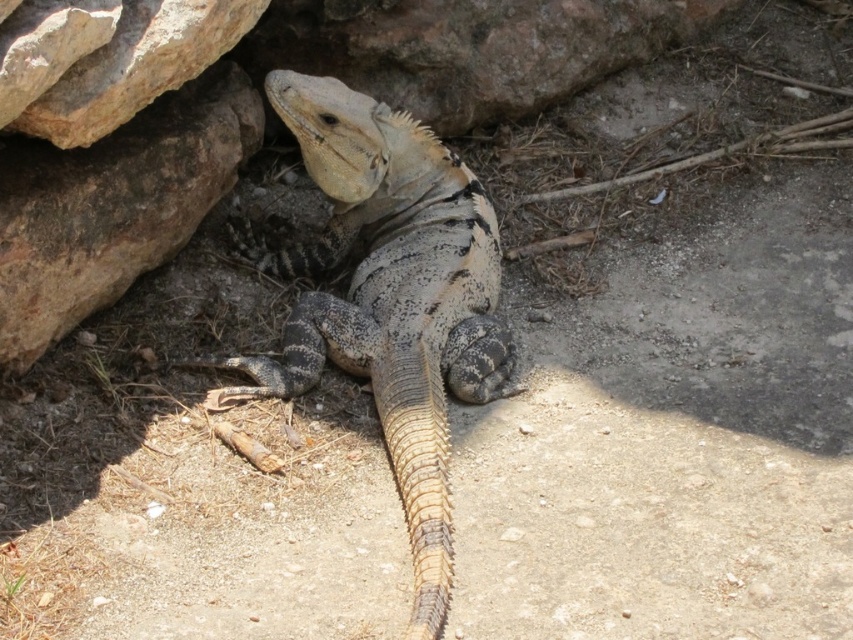
You are standing in the desert scene with the lizard. There are two points marked in the image. Which point is closer to your eyes? The points are point [381,282] and point [67,164].

Point [67,164] is closer to your eyes because the Objects Description states that point [381,282] is further to the viewer than point [67,164].

You are a small desert animal seeking shelter from the midday sun. You notice the brown rough rock at upper left and the smooth beige rock at upper left. Which rock would provide more shade coverage for you to stay under?

The brown rough rock at upper left and smooth beige rock at upper left are 13.74 inches apart, so you can choose either one as the distance between them is sufficient to provide shade coverage.

You are a geologist examining the image. You need to locate the brown rough rock at upper left. What is its exact 2D coordinate in the image?

The brown rough rock at upper left is located at the 2D coordinate point of (x=113, y=205).